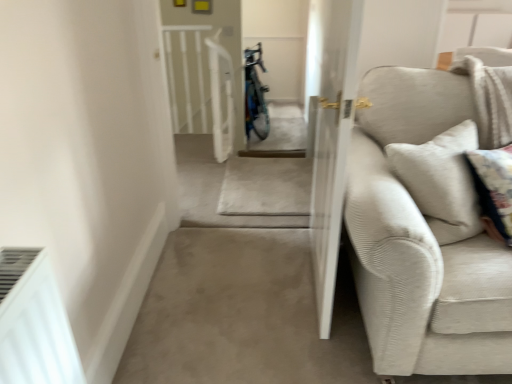
Measure the distance between beige corduroy couch at right and camera.

4.01 feet.

What do you see at coordinates (426, 226) in the screenshot?
I see `beige corduroy couch at right` at bounding box center [426, 226].

At what (x,y) coordinates should I click in order to perform the action: click on beige corduroy couch at right. Please return your answer as a coordinate pair (x, y). This screenshot has height=384, width=512. Looking at the image, I should click on (426, 226).

Measure the distance between white textured screen door at center and camera.

They are 1.40 meters apart.

What is the approximate height of white textured screen door at center?

It is 1.28 meters.

Image resolution: width=512 pixels, height=384 pixels. Find the location of `white textured screen door at center`. white textured screen door at center is located at coordinates (330, 133).

This screenshot has width=512, height=384. What do you see at coordinates (330, 133) in the screenshot?
I see `white textured screen door at center` at bounding box center [330, 133].

This screenshot has height=384, width=512. I want to click on beige corduroy couch at right, so click(x=426, y=226).

Visually, is white textured screen door at center positioned to the left or to the right of beige corduroy couch at right?

white textured screen door at center is to the left of beige corduroy couch at right.

In the image, is white textured screen door at center positioned in front of or behind beige corduroy couch at right?

white textured screen door at center is positioned farther from the viewer than beige corduroy couch at right.

Considering the positions of points (314, 126) and (407, 341), is point (314, 126) closer to camera compared to point (407, 341)?

No.

From the image's perspective, is white textured screen door at center above beige corduroy couch at right?

Indeed, from the image's perspective, white textured screen door at center is shown above beige corduroy couch at right.

From a real-world perspective, which object stands above the other?

In real-world perspective, white textured screen door at center is above.

Does white textured screen door at center have a greater width compared to beige corduroy couch at right?

Incorrect, the width of white textured screen door at center does not surpass that of beige corduroy couch at right.

Which of these two, white textured screen door at center or beige corduroy couch at right, stands shorter?

With less height is beige corduroy couch at right.

Based on their sizes in the image, would you say white textured screen door at center is bigger or smaller than beige corduroy couch at right?

In the image, white textured screen door at center appears to be smaller than beige corduroy couch at right.

Choose the correct answer: Is white textured screen door at center inside beige corduroy couch at right or outside it?

white textured screen door at center exists outside the volume of beige corduroy couch at right.

Is white textured screen door at center placed right next to beige corduroy couch at right?

No, white textured screen door at center is not touching beige corduroy couch at right.

Is white textured screen door at center looking in the opposite direction of beige corduroy couch at right?

Yes, beige corduroy couch at right is at the back of white textured screen door at center.

Can you tell me how much white textured screen door at center and beige corduroy couch at right differ in facing direction?

93.5 degrees separate the facing orientations of white textured screen door at center and beige corduroy couch at right.

You are a GUI agent. You are given a task and a screenshot of the screen. Output one action in this format:
    pyautogui.click(x=<x>, y=<y>)
    Task: Click on the screen door lying above the beige corduroy couch at right (from the image's perspective)
    
    Given the screenshot: What is the action you would take?
    pyautogui.click(x=330, y=133)

Considering the relative positions of beige corduroy couch at right and white textured screen door at center in the image provided, is beige corduroy couch at right to the left or to the right of white textured screen door at center?

Clearly, beige corduroy couch at right is on the right of white textured screen door at center in the image.

Is beige corduroy couch at right in front of white textured screen door at center?

Yes, beige corduroy couch at right is closer to the viewer.

Considering the positions of point (422, 159) and point (309, 152), is point (422, 159) closer or farther from the camera than point (309, 152)?

Point (422, 159) is positioned closer to the camera compared to point (309, 152).

From the image's perspective, between beige corduroy couch at right and white textured screen door at center, which one is located above?

white textured screen door at center is shown above in the image.

From a real-world perspective, is beige corduroy couch at right beneath white textured screen door at center?

Yes, from a real-world perspective, beige corduroy couch at right is below white textured screen door at center.

From the picture: Considering the relative sizes of beige corduroy couch at right and white textured screen door at center in the image provided, is beige corduroy couch at right wider than white textured screen door at center?

Yes, beige corduroy couch at right is wider than white textured screen door at center.

In terms of height, does beige corduroy couch at right look taller or shorter compared to white textured screen door at center?

beige corduroy couch at right is shorter than white textured screen door at center.

Does beige corduroy couch at right have a larger size compared to white textured screen door at center?

Correct, beige corduroy couch at right is larger in size than white textured screen door at center.

Is beige corduroy couch at right positioned beyond the bounds of white textured screen door at center?

Indeed, beige corduroy couch at right is completely outside white textured screen door at center.

Does beige corduroy couch at right touch white textured screen door at center?

There is a gap between beige corduroy couch at right and white textured screen door at center.

Could you tell me if beige corduroy couch at right is turned towards white textured screen door at center?

No.

The width and height of the screenshot is (512, 384). In order to click on screen door positioned vertically above the beige corduroy couch at right (from a real-world perspective) in this screenshot , I will do `click(330, 133)`.

At what (x,y) coordinates should I click in order to perform the action: click on studio couch in front of the white textured screen door at center. Please return your answer as a coordinate pair (x, y). Looking at the image, I should click on (426, 226).

Locate an element on the screen. studio couch below the white textured screen door at center (from a real-world perspective) is located at coordinates pyautogui.click(x=426, y=226).